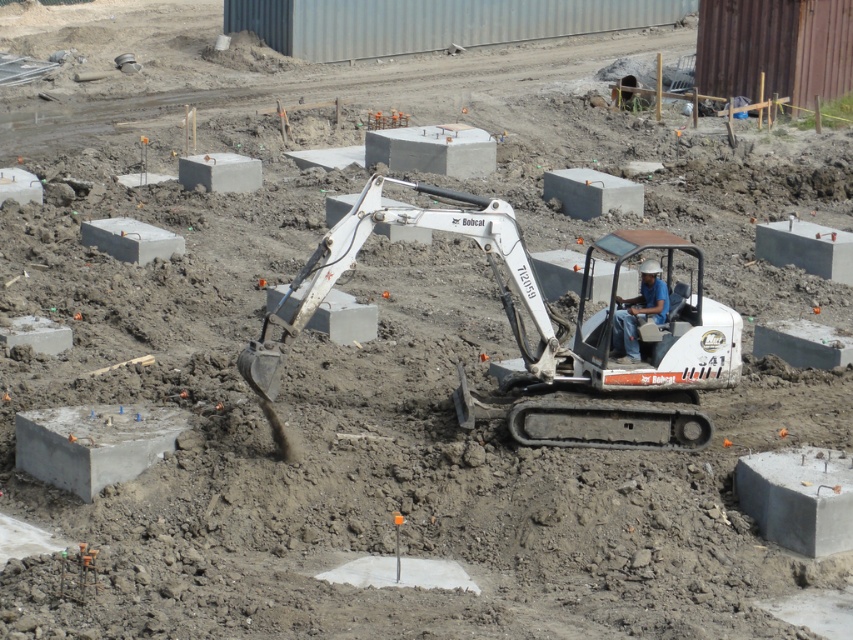
You are a safety inspector standing at the edge of the construction site. You need to access the gray concrete block at lower right to inspect its stability. The path between you and the block requires passing by the white metallic excavator at center. Can you safely walk around the excavator to reach the block without getting too close?

The white metallic excavator at center is further to the viewer than the gray concrete block at lower right, meaning the excavator is closer to your current position. To reach the block, you would need to walk past the excavator, which is feasible as long as you maintain a safe distance from the machinery. Proceed with caution, staying clear of the excavator and its moving parts.

You are a safety inspector at the construction site. You need to ensure that the white metallic excavator at center is not taller than the blue fabric construction worker at center to comply with safety regulations. Is the current setup compliant?

The white metallic excavator at center is not as tall as the blue fabric construction worker at center, so the setup is compliant with the safety regulations.